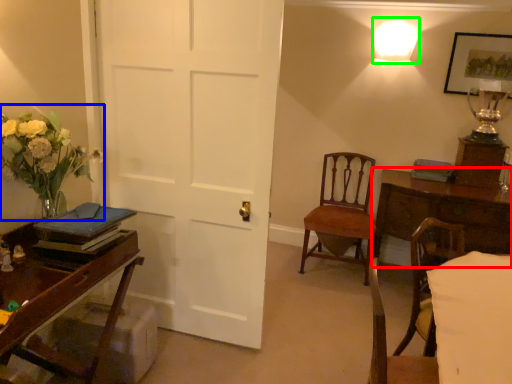
Question: Which object is positioned closest to table (highlighted by a red box)? Select from floral arrangement (highlighted by a blue box) and lighting (highlighted by a green box).

Choices:
 (A) floral arrangement
 (B) lighting

Answer: (B)